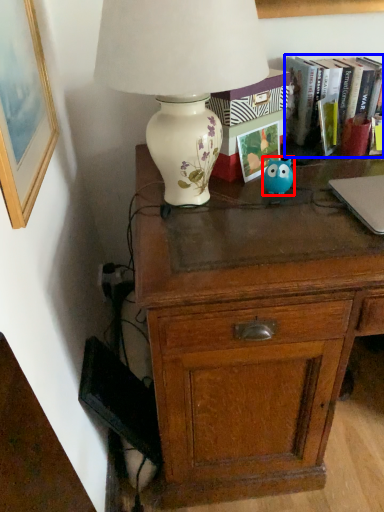
Question: Which of the following is the farthest to the observer, animal (highlighted by a red box) or book (highlighted by a blue box)?

Choices:
 (A) animal
 (B) book

Answer: (B)